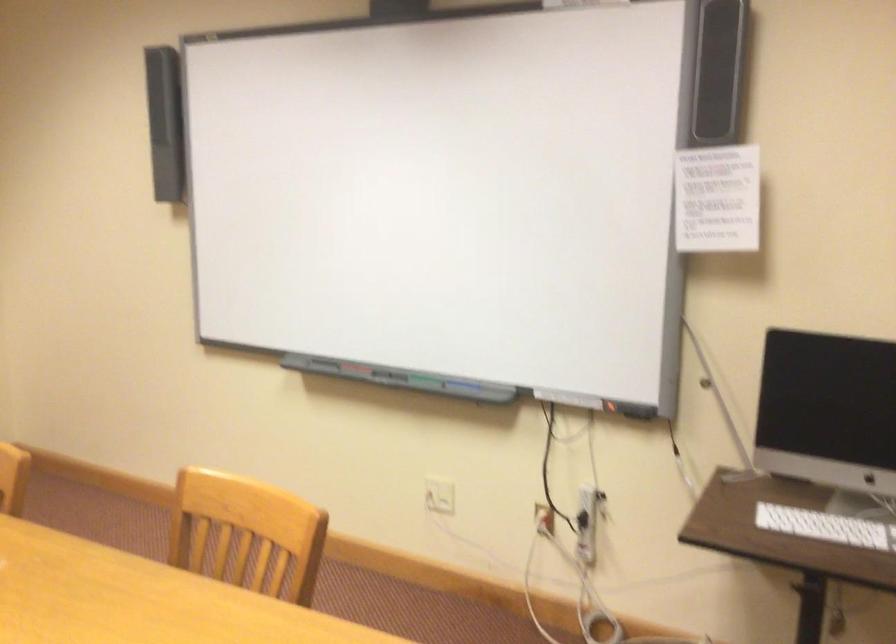
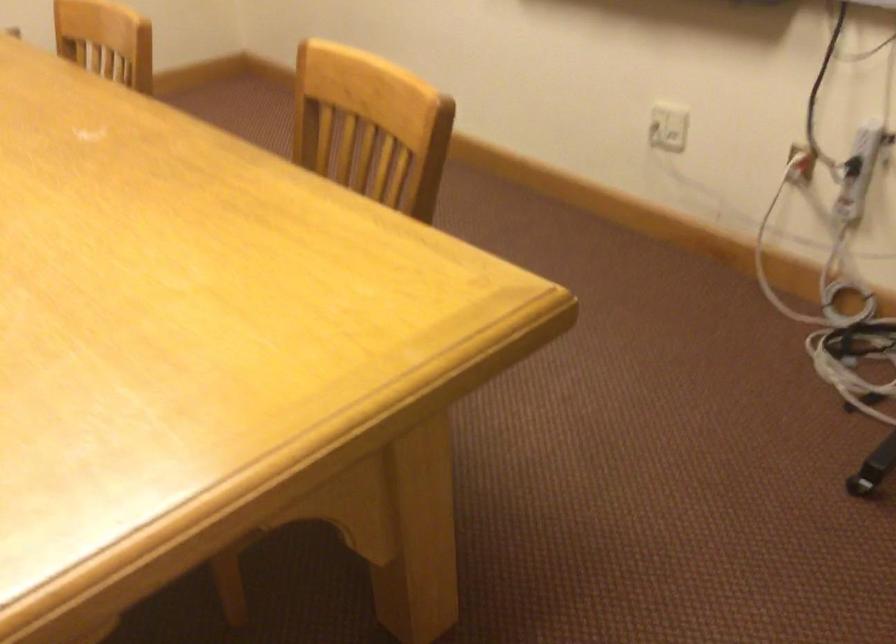
Find the pixel in the second image that matches the point at 540,516 in the first image.

(800, 164)